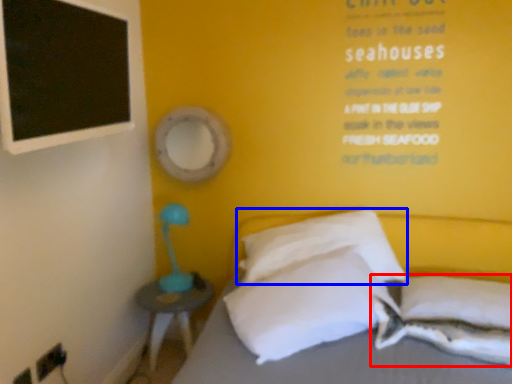
Question: Which object appears farthest to the camera in this image, pillow (highlighted by a red box) or pillow (highlighted by a blue box)?

Choices:
 (A) pillow
 (B) pillow

Answer: (B)